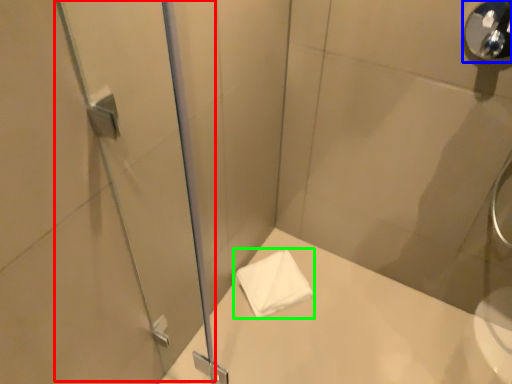
Question: Which object is positioned closest to screen door (highlighted by a red box)? Select from shower (highlighted by a blue box) and towel (highlighted by a green box).

Choices:
 (A) shower
 (B) towel

Answer: (B)